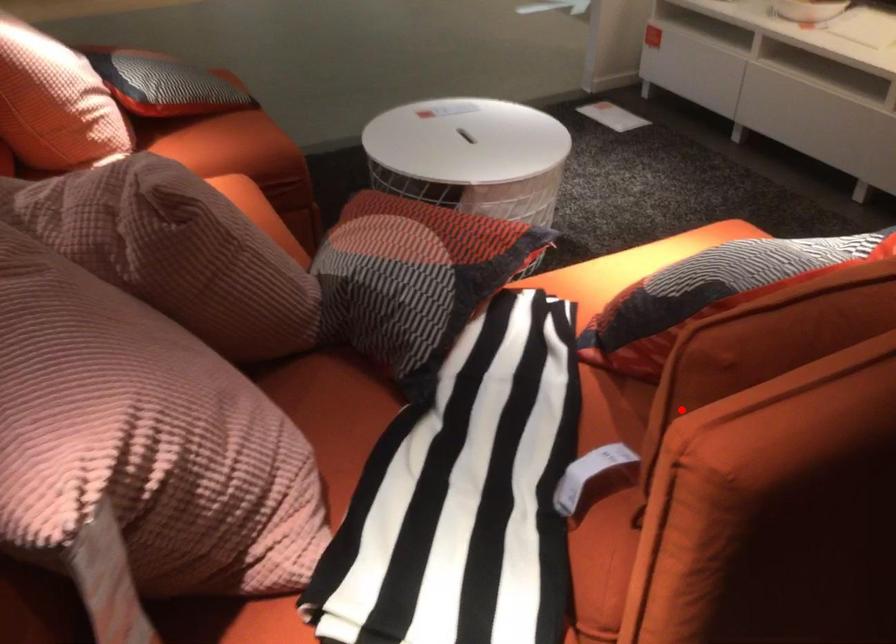
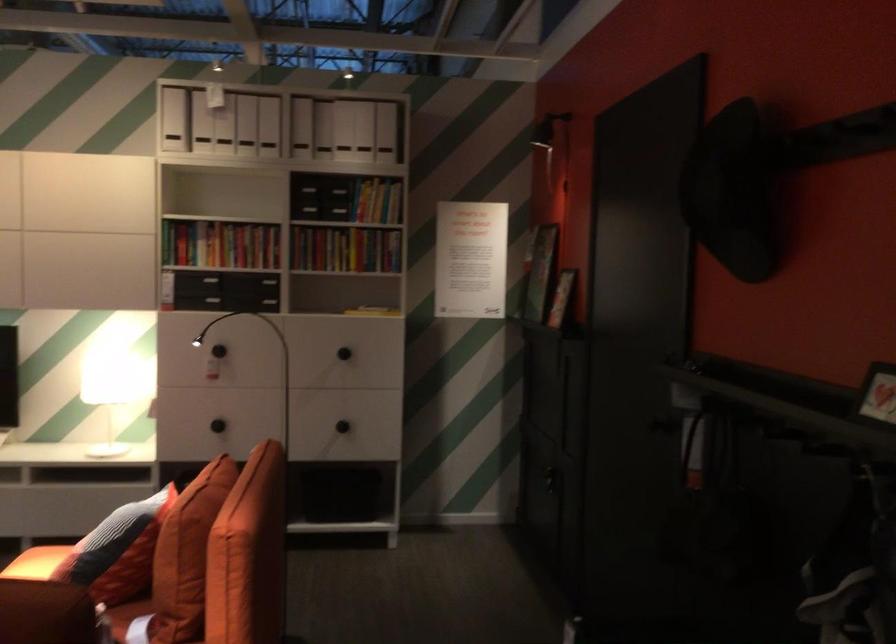
Find the pixel in the second image that matches the highlighted location in the first image.

(186, 554)